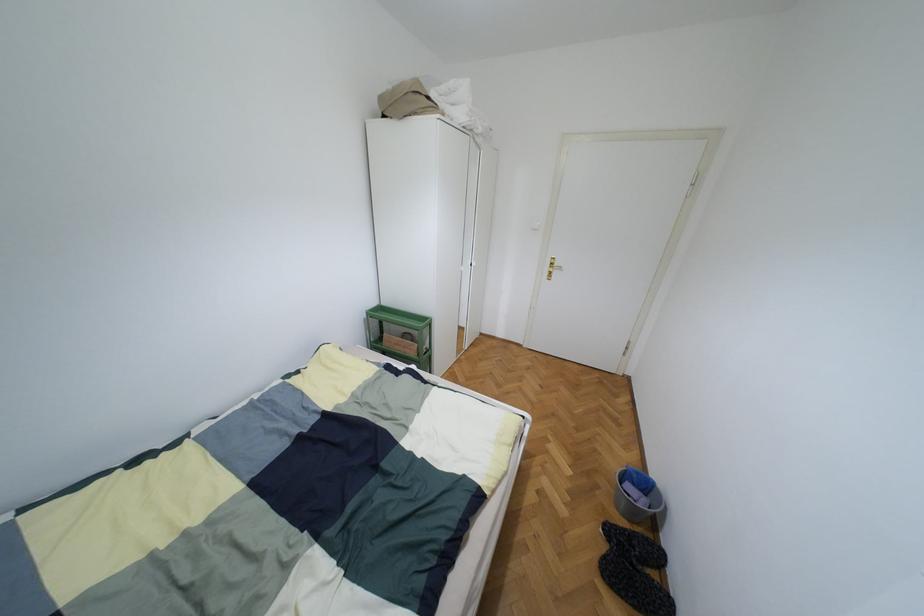
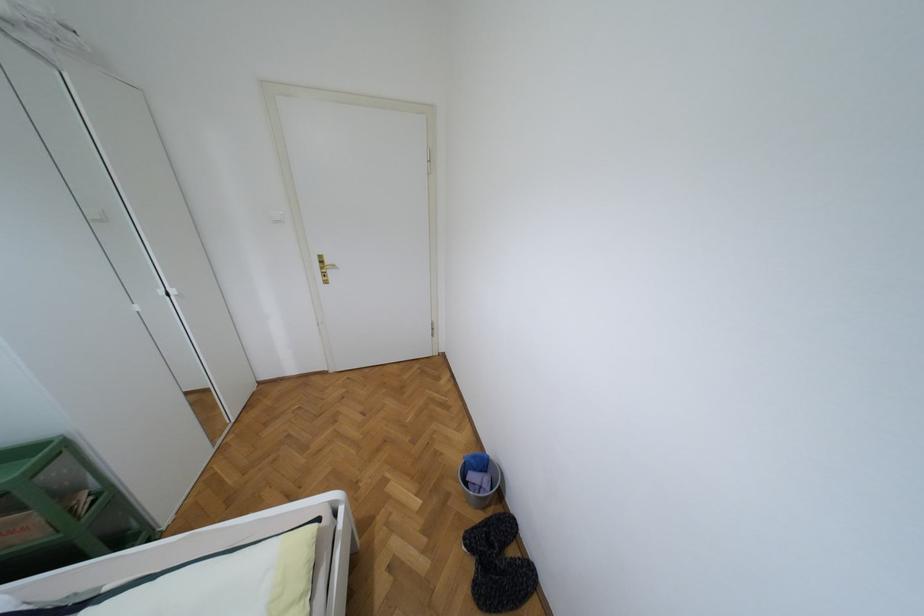
Question: Based on the continuous images, in which direction is the camera rotating? Reply with the corresponding letter.

Choices:
 (A) Left
 (B) Right
 (C) Up
 (D) Down

Answer: (B)